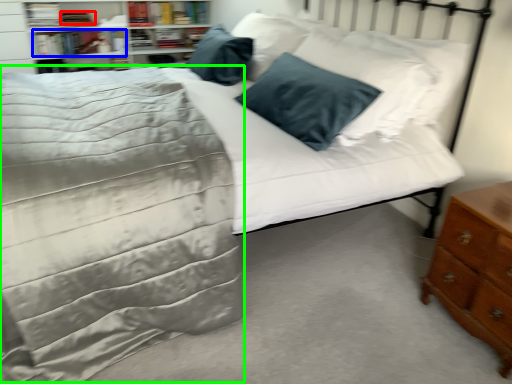
Question: Which is nearer to the book (highlighted by a red box)? book (highlighted by a blue box) or bedding (highlighted by a green box).

Choices:
 (A) book
 (B) bedding

Answer: (A)